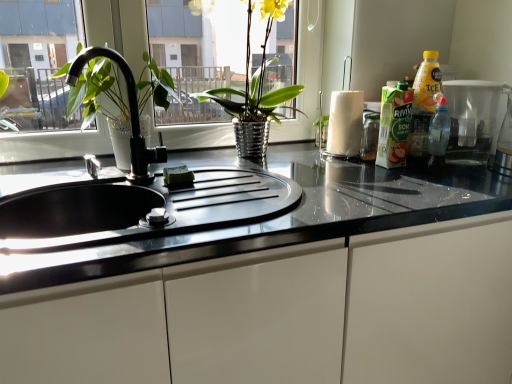
Identify the location of free space above glossy white cabinet at center (from a real-world perspective). (245, 187).